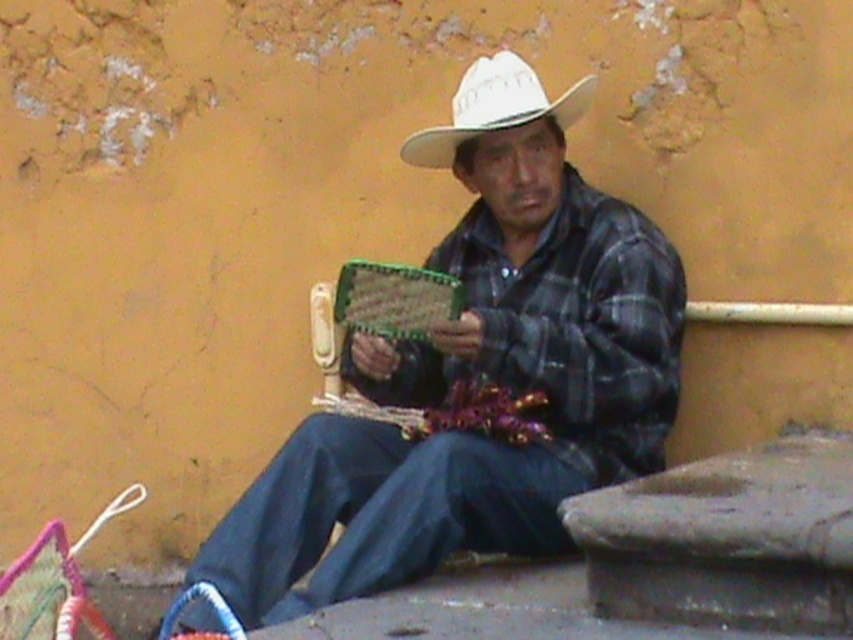
You are a fashion designer observing the man in the image. You need to determine which item of clothing is taller between the plaid fabric shirt at center and the white matte cowboy hat at center. Which one is taller?

The plaid fabric shirt at center is taller than the white matte cowboy hat at center according to the description.